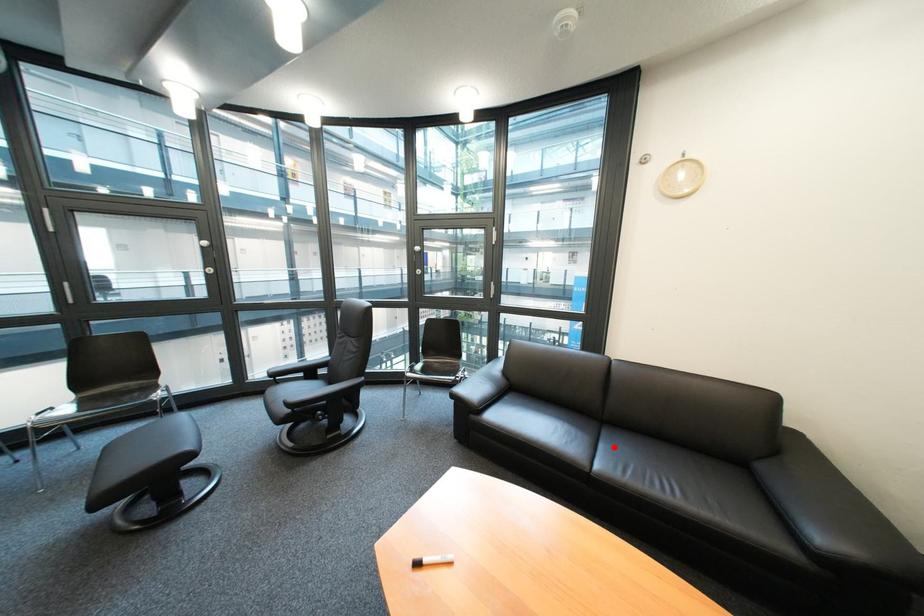
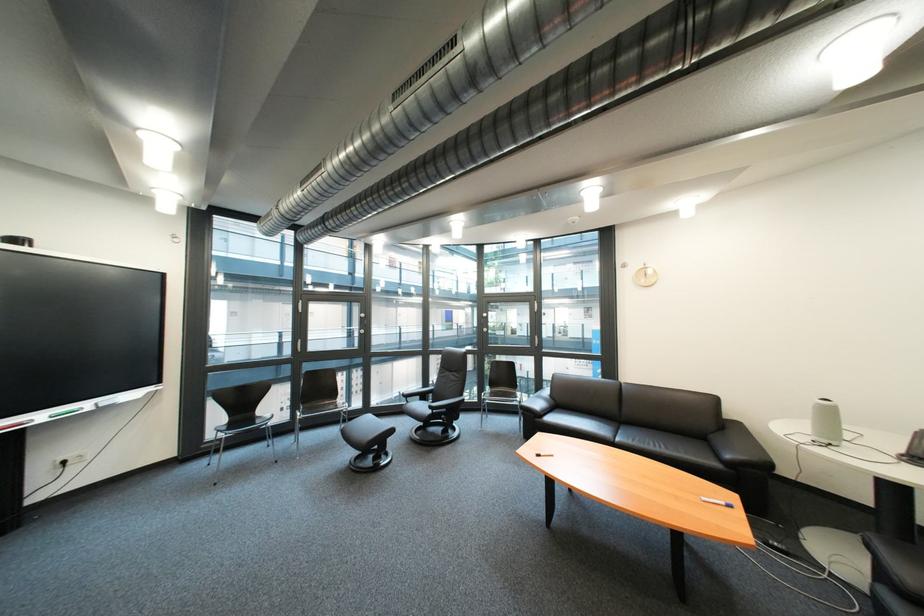
Find the pixel in the second image that matches the highlighted location in the first image.

(634, 434)